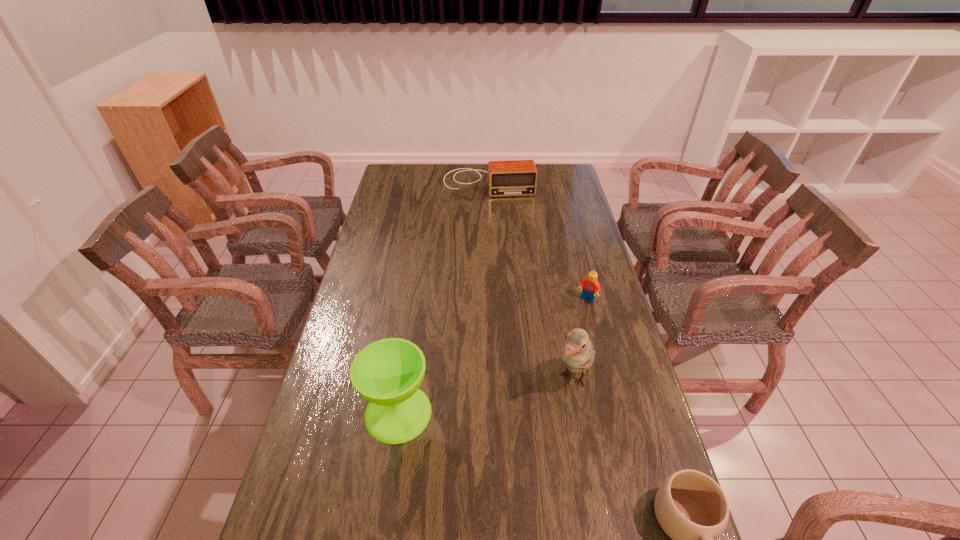
Image resolution: width=960 pixels, height=540 pixels. Find the location of `the fourth shortest object`. the fourth shortest object is located at coordinates (387, 373).

Find the location of a particular element. This screenshot has width=960, height=540. bird is located at coordinates (578, 355).

Find the location of `the fourth nearest object`. the fourth nearest object is located at coordinates (591, 287).

Identify the location of the farthest object. (515, 177).

Find the location of `vacant area situated 0.050m on the front of the second tallest object`. vacant area situated 0.050m on the front of the second tallest object is located at coordinates pos(391,463).

The height and width of the screenshot is (540, 960). In order to click on vacant region located 0.320m at the face of the bird in this screenshot , I will do `click(503, 498)`.

Where is `vacant area situated at the face of the bird`? vacant area situated at the face of the bird is located at coordinates (503, 498).

At what (x,y) coordinates should I click in order to perform the action: click on free location located 0.260m at the face of the bird. Please return your answer as a coordinate pair (x, y). This screenshot has width=960, height=540. Looking at the image, I should click on (516, 477).

Where is `vacant region located 0.250m on the face of the Lego`? vacant region located 0.250m on the face of the Lego is located at coordinates (x=551, y=355).

Identify the location of vacant space located on the face of the Lego. (570, 324).